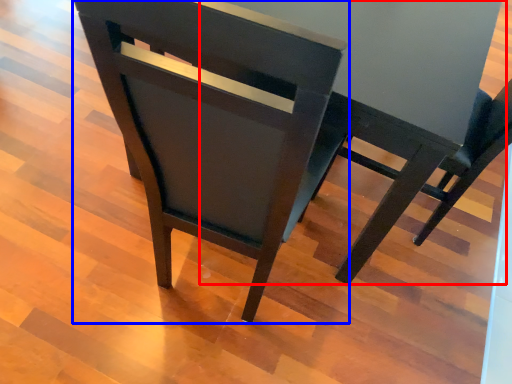
Question: Which object is closer to the camera taking this photo, round table (highlighted by a red box) or chair (highlighted by a blue box)?

Choices:
 (A) round table
 (B) chair

Answer: (B)